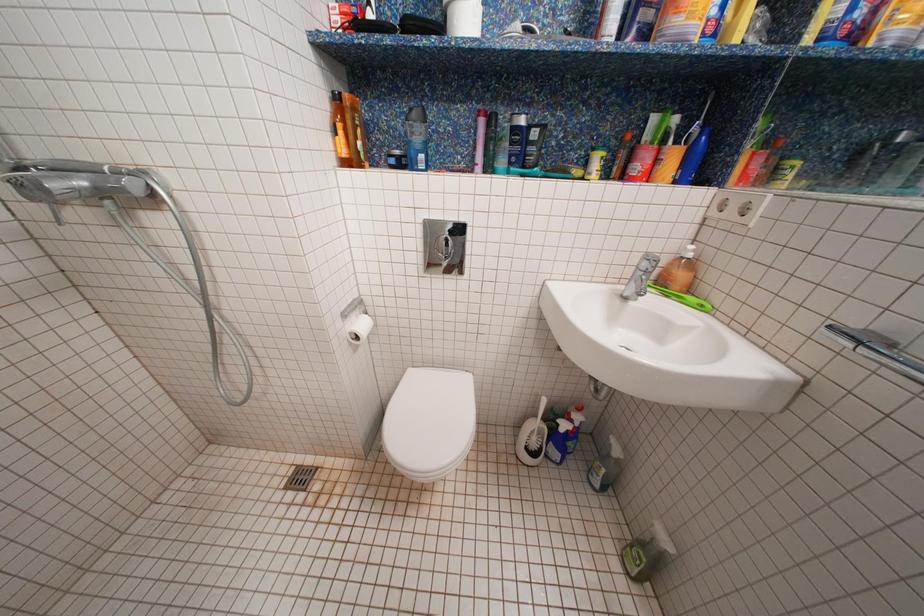
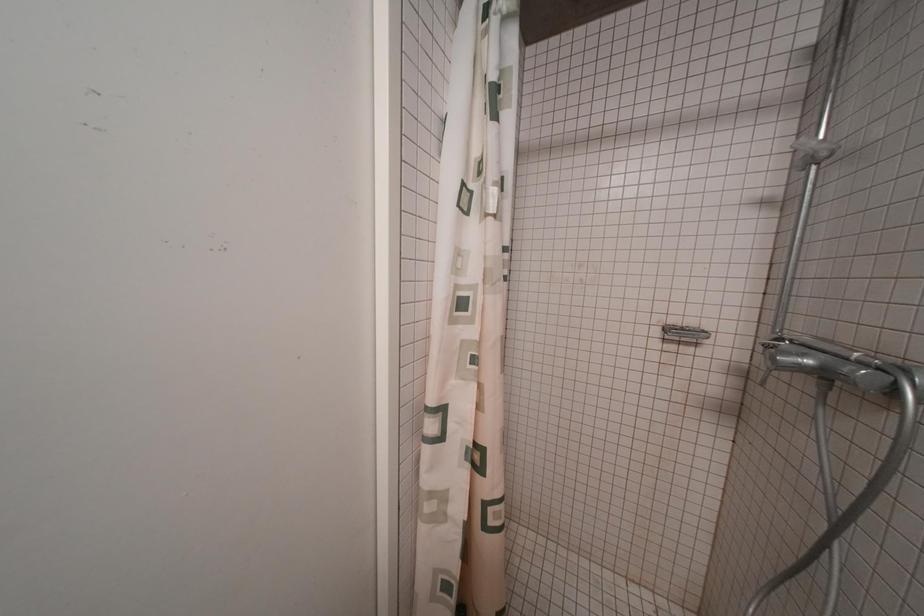
The images are taken continuously from a first-person perspective. In which direction is your viewpoint rotating?

The rotation direction of the camera is left-down.